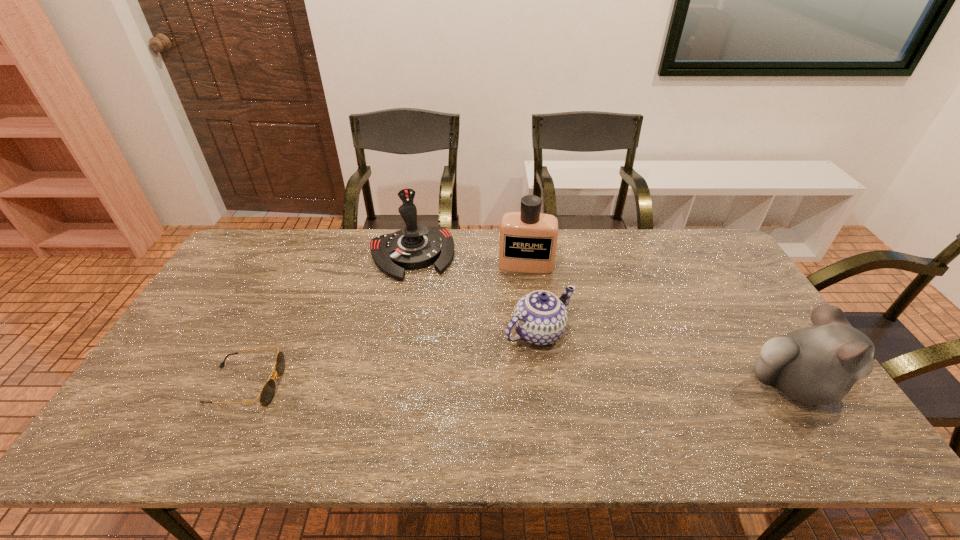
At what (x,y) coordinates should I click in order to perform the action: click on free space that satisfies the following two spatial constraints: 1. on the front side of the hamster; 2. on the face of the perfume. Please return your answer as a coordinate pair (x, y). This screenshot has width=960, height=540. Looking at the image, I should click on (540, 385).